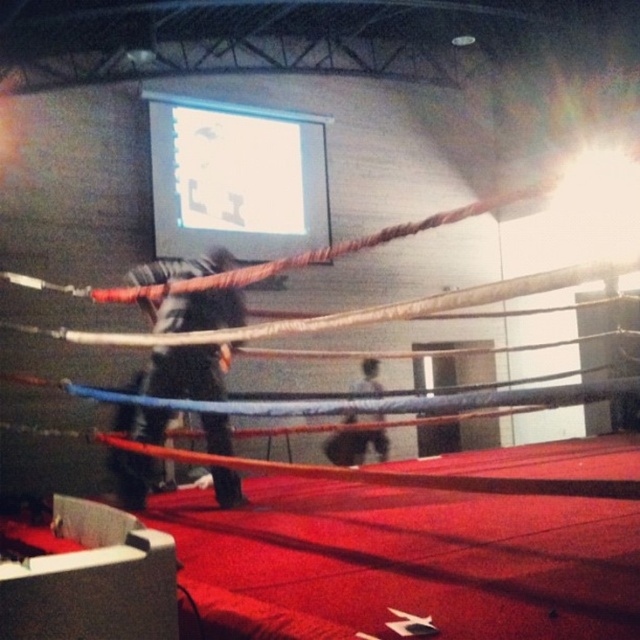
Question: Is black matte pants at center thinner than dark blue fabric at center?

Choices:
 (A) no
 (B) yes

Answer: (A)

Question: In this image, where is black matte pants at center located relative to dark blue fabric at center?

Choices:
 (A) right
 (B) left

Answer: (B)

Question: Which point appears closest to the camera in this image?

Choices:
 (A) (340, 442)
 (B) (244, 173)
 (C) (182, 259)

Answer: (C)

Question: Can you confirm if white glossy projection screen at upper center is positioned above dark blue fabric at center?

Choices:
 (A) yes
 (B) no

Answer: (A)

Question: Which point appears closest to the camera in this image?

Choices:
 (A) (314, 227)
 (B) (141, 426)
 (C) (337, 433)

Answer: (B)

Question: Which of the following is the farthest from the observer?

Choices:
 (A) white glossy projection screen at upper center
 (B) dark blue fabric at center

Answer: (A)